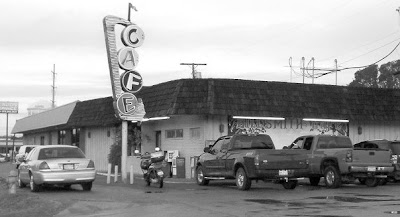
In order to click on plant in this screenshot , I will do `click(114, 155)`.